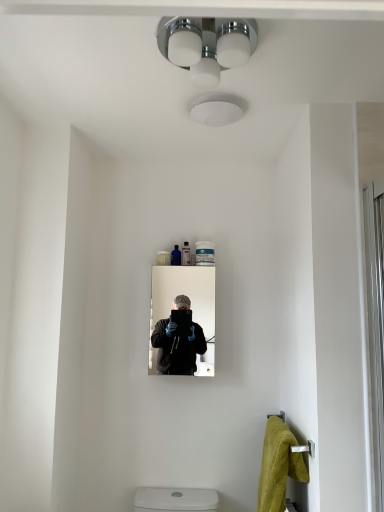
Question: Would you say yellow plush towel at lower right is to the left or to the right of white glossy screen door at right in the picture?

Choices:
 (A) left
 (B) right

Answer: (A)

Question: Is yellow plush towel at lower right taller or shorter than white glossy screen door at right?

Choices:
 (A) short
 (B) tall

Answer: (A)

Question: Based on their relative distances, which object is nearer to the translucent plastic tube at center, which is the second toiletry from left to right?

Choices:
 (A) white glossy screen door at right
 (B) yellow plush towel at lower right
 (C) matte black mirror at center
 (D) chrome/textured glass light fixture at upper center
 (E) translucent blue bottle at upper center, which appears as the 1th toiletry when viewed from the left

Answer: (E)

Question: Which of these objects is positioned farthest from the chrome/textured glass light fixture at upper center?

Choices:
 (A) yellow plush towel at lower right
 (B) white glossy screen door at right
 (C) translucent plastic tube at center, which is the second toiletry from left to right
 (D) translucent blue bottle at upper center, which appears as the 1th toiletry when viewed from the left
 (E) matte black mirror at center

Answer: (A)